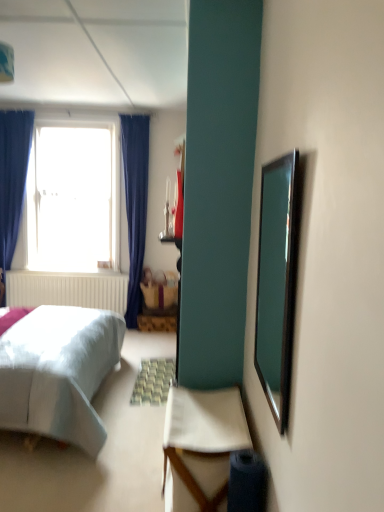
Question: In terms of height, does white fabric chair at lower center look taller or shorter compared to clear glass mirror at right?

Choices:
 (A) short
 (B) tall

Answer: (A)

Question: Does point (215, 460) appear closer or farther from the camera than point (261, 189)?

Choices:
 (A) farther
 (B) closer

Answer: (B)

Question: Which object is the closest to the clear glass mirror at right?

Choices:
 (A) wooden picnic basket at center
 (B) white fabric chair at lower center
 (C) transparent glass window at upper left

Answer: (B)

Question: Which object is the closest to the white fabric chair at lower center?

Choices:
 (A) wooden picnic basket at center
 (B) transparent glass window at upper left
 (C) clear glass mirror at right

Answer: (C)